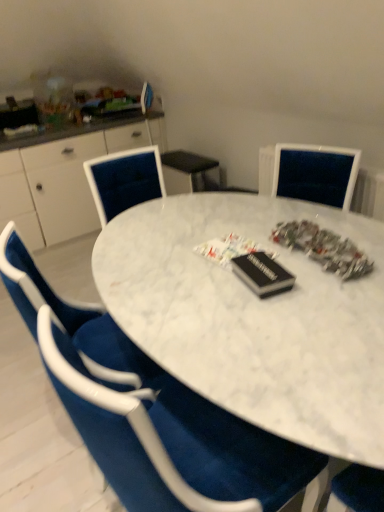
I want to click on white marble table at center, so click(x=254, y=318).

Measure the distance between white marble table at center and camera.

white marble table at center is 31.03 inches away from camera.

Measure the distance between point (x=55, y=223) and camera.

The distance of point (x=55, y=223) from camera is 3.02 meters.

The image size is (384, 512). What are the coordinates of `white marble table at center` in the screenshot? It's located at (254, 318).

Is white glossy cabinet at left a part of white marble table at center?

No, white glossy cabinet at left is not inside white marble table at center.

What's the angular difference between white marble table at center and white glossy cabinet at left's facing directions?

They differ by 4.54 degrees in their facing directions.

Consider the image. From a real-world perspective, between white marble table at center and white glossy cabinet at left, who is vertically lower?

white marble table at center.

Is white marble table at center turned away from white glossy cabinet at left?

Yes, white marble table at center is positioned with its back facing white glossy cabinet at left.

This screenshot has width=384, height=512. In order to click on computer desk that is under the velvet blue chair at center (from a real-world perspective) in this screenshot , I will do `click(60, 181)`.

Is velvet blue chair at center turned away from white glossy cabinet at left?

No, white glossy cabinet at left is not at the back of velvet blue chair at center.

Between point (51, 351) and point (1, 179), which one is positioned in front?

The point (51, 351) is in front.

Consider the image. Would you say white glossy cabinet at left is outside white marble table at center?

Yes, white glossy cabinet at left is outside of white marble table at center.

Based on the photo, is white glossy cabinet at left not close to white marble table at center?

Yes.

In terms of height, does white glossy cabinet at left look taller or shorter compared to white marble table at center?

Considering their sizes, white glossy cabinet at left has more height than white marble table at center.

Consider the image. Can you confirm if white marble table at center is positioned to the left of velvet blue chair at center?

No, white marble table at center is not to the left of velvet blue chair at center.

Considering the positions of points (335, 443) and (92, 398), is point (335, 443) farther from camera compared to point (92, 398)?

That is True.

Is velvet blue chair at center surrounded by white marble table at center?

Absolutely, velvet blue chair at center is inside white marble table at center.

Consider the image. Considering the sizes of objects white marble table at center and velvet blue chair at center in the image provided, who is wider, white marble table at center or velvet blue chair at center?

white marble table at center.

Is velvet blue chair at center facing towards white marble table at center?

Yes, velvet blue chair at center is aimed at white marble table at center.

Locate an element on the screen. This screenshot has height=512, width=384. desk that is under the velvet blue chair at center (from a real-world perspective) is located at coordinates (254, 318).

Measure the distance between velvet blue chair at center and white marble table at center.

velvet blue chair at center is 14.00 inches away from white marble table at center.

Looking at this image, how different are the orientations of velvet blue chair at center and white marble table at center in degrees?

They differ by 85.6 degrees in their facing directions.

Which of these two, white glossy cabinet at left or velvet blue chair at center, is bigger?

With larger size is white glossy cabinet at left.

From a real-world perspective, is white glossy cabinet at left under velvet blue chair at center?

Yes.

Can you confirm if white glossy cabinet at left is positioned to the right of velvet blue chair at center?

No, white glossy cabinet at left is not to the right of velvet blue chair at center.

Is white glossy cabinet at left situated inside velvet blue chair at center or outside?

The correct answer is: outside.

The width and height of the screenshot is (384, 512). In order to click on desk on the right of white glossy cabinet at left in this screenshot , I will do `click(254, 318)`.

Where is `chair located in front of the white glossy cabinet at left`? chair located in front of the white glossy cabinet at left is located at coordinates (176, 443).

When comparing their distances from white glossy cabinet at left, does white marble table at center or velvet blue chair at center seem closer?

Based on the image, white marble table at center appears to be nearer to white glossy cabinet at left.

Considering their positions, is white glossy cabinet at left positioned further to white marble table at center than velvet blue chair at center?

white glossy cabinet at left lies further to white marble table at center than the other object.

Looking at the image, which one is located closer to white marble table at center, velvet blue chair at center or white glossy cabinet at left?

velvet blue chair at center.

Looking at the image, which one is located further to velvet blue chair at center, white glossy cabinet at left or white marble table at center?

white glossy cabinet at left lies further to velvet blue chair at center than the other object.

When comparing their distances from white glossy cabinet at left, does velvet blue chair at center or white marble table at center seem further?

The object further to white glossy cabinet at left is velvet blue chair at center.

Which object lies nearer to the anchor point velvet blue chair at center, white marble table at center or white glossy cabinet at left?

The object closer to velvet blue chair at center is white marble table at center.

The height and width of the screenshot is (512, 384). Identify the location of desk between velvet blue chair at center and white glossy cabinet at left from front to back. (254, 318).